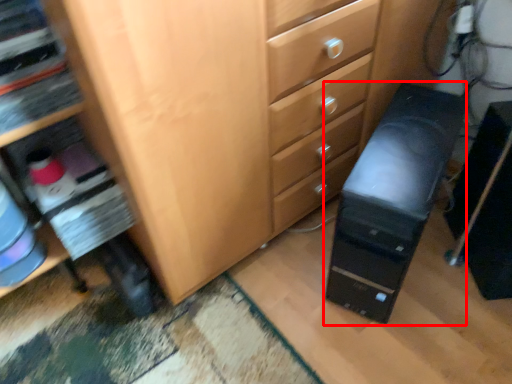
Question: From the image's perspective, where is computer tower (annotated by the red box) located relative to computer tower?

Choices:
 (A) above
 (B) below

Answer: (A)